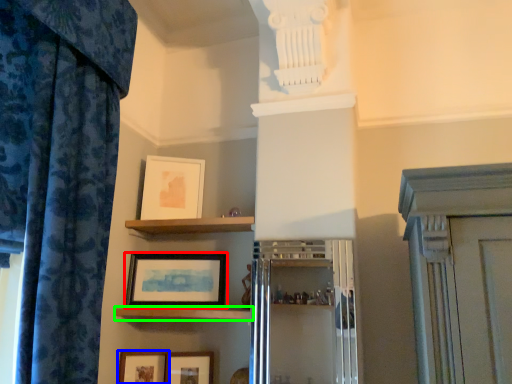
Question: Estimate the real-world distances between objects in this image. Which object is farther from picture frame (highlighted by a red box), picture frame (highlighted by a blue box) or shelf (highlighted by a green box)?

Choices:
 (A) picture frame
 (B) shelf

Answer: (A)